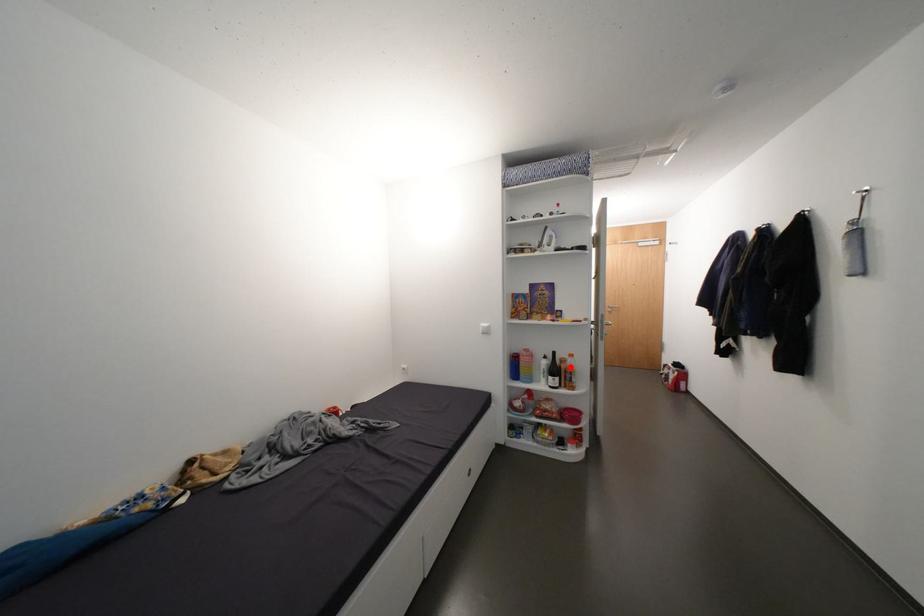
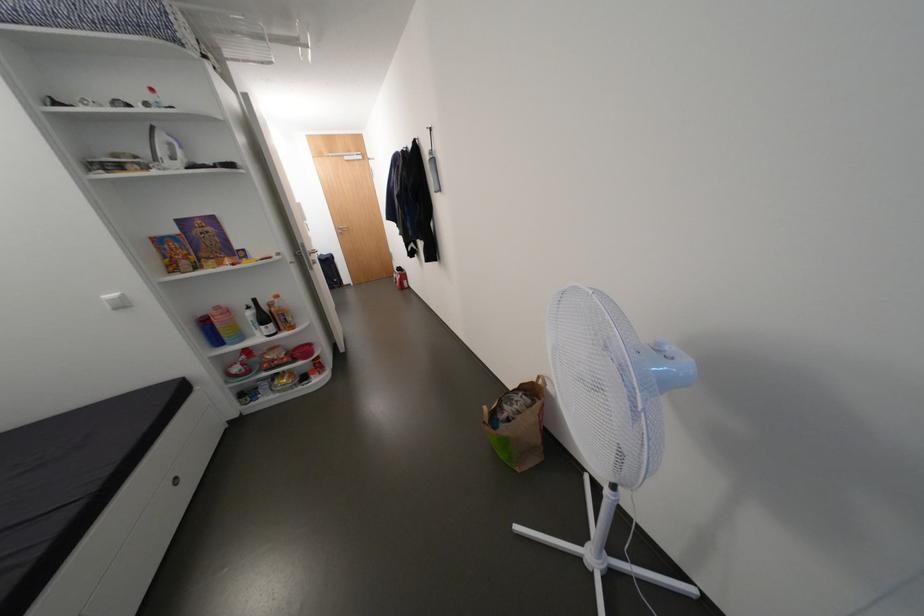
Find the pixel in the second image that matches the highlighted location in the first image.

(281, 310)